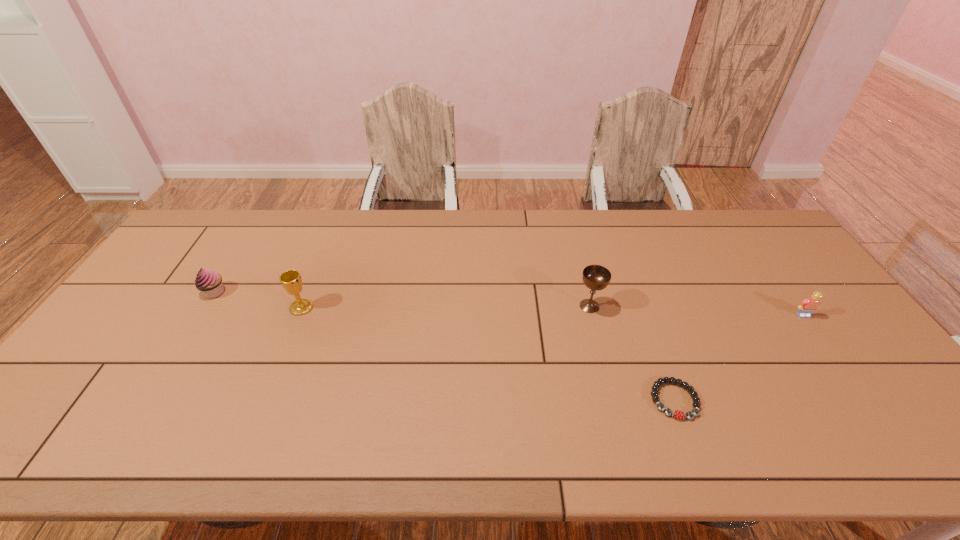
This screenshot has height=540, width=960. Find the location of `free space located 0.140m on the left of the fourth object from left to right`. free space located 0.140m on the left of the fourth object from left to right is located at coordinates click(x=592, y=400).

Identify the location of object that is positioned at the right edge. Image resolution: width=960 pixels, height=540 pixels. [x=809, y=305].

At what (x,y) coordinates should I click in order to perform the action: click on vacant area at the far edge. Please return your answer as a coordinate pair (x, y). Image resolution: width=960 pixels, height=540 pixels. Looking at the image, I should click on (522, 227).

The image size is (960, 540). I want to click on free space at the near edge of the desktop, so click(631, 431).

Image resolution: width=960 pixels, height=540 pixels. In the image, there is a desktop. Find the location of `free space at the left edge`. free space at the left edge is located at coordinates (124, 335).

In the image, there is a desktop. Where is `free space at the far left corner`? Image resolution: width=960 pixels, height=540 pixels. free space at the far left corner is located at coordinates (229, 228).

This screenshot has height=540, width=960. I want to click on vacant point at the far right corner, so [755, 226].

The image size is (960, 540). I want to click on vacant region between the right chalice and the Lego, so click(696, 310).

At what (x,y) coordinates should I click in order to perform the action: click on empty space between the cupcake and the third object from right to left. Please return your answer as a coordinate pair (x, y). The width and height of the screenshot is (960, 540). Looking at the image, I should click on (402, 299).

Locate an element on the screen. The image size is (960, 540). free spot between the cupcake and the second object from left to right is located at coordinates (258, 300).